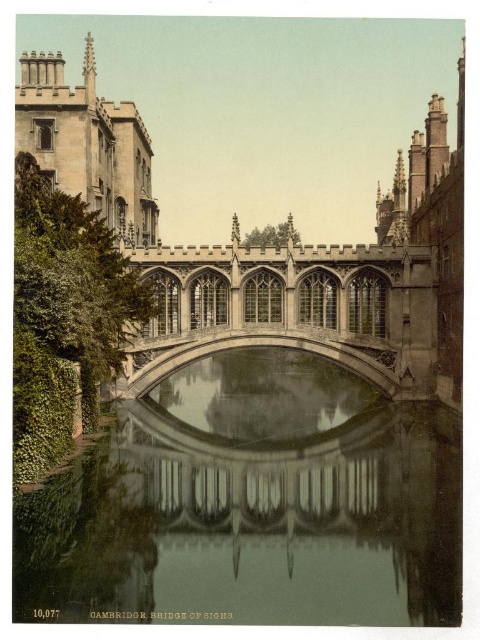
Can you confirm if clear glass water at center is bigger than stone gothic arch bridge at center?

Indeed, clear glass water at center has a larger size compared to stone gothic arch bridge at center.

Does clear glass water at center have a greater height compared to stone gothic arch bridge at center?

Yes, clear glass water at center is taller than stone gothic arch bridge at center.

Is point (237, 416) farther from camera compared to point (204, 330)?

That is True.

The height and width of the screenshot is (640, 480). In order to click on clear glass water at center in this screenshot , I will do `click(252, 506)`.